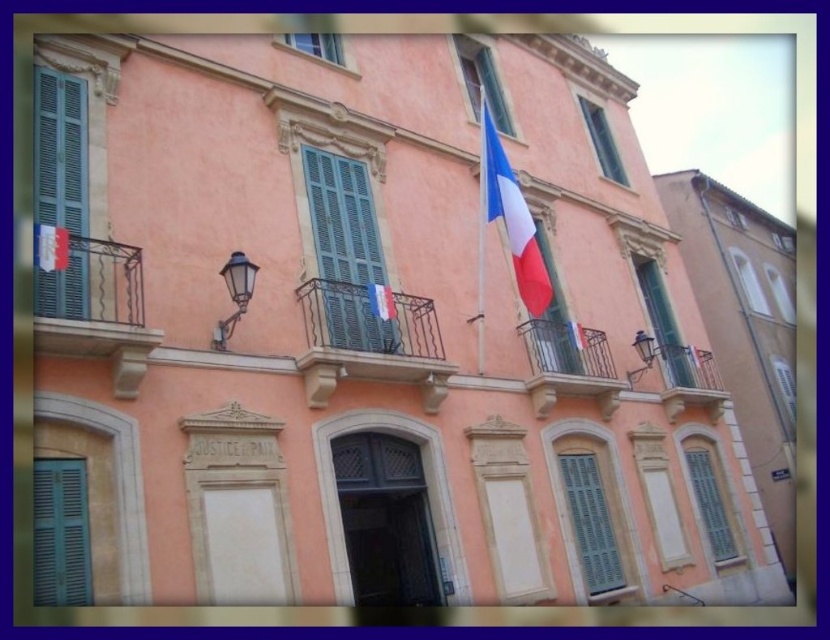
You are standing in front of the two story building. There is a point at coordinate (369, 340). What is this point located on?

The point at coordinate (369, 340) is located on the iron railing at center.

You are an architect evaluating the building. You need to install a new security camera. The camera must be placed on the object that is bigger in size between the rustic wood balcony at center and the white matte window at upper right. Which object should you choose?

The rustic wood balcony at center is larger in size compared to the white matte window at upper right, so you should place the security camera on the rustic wood balcony at center.

You are an architect evaluating the building. You need to install a new security camera. The camera requires a mounting point that can support its weight. Which of the two objects, the metallic brass balcony at upper right or the matte glass window at right, is more suitable for mounting the camera based on their size?

The metallic brass balcony at upper right is larger in size than the matte glass window at right, making it more suitable for mounting the camera as it can provide a more stable and secure support point.